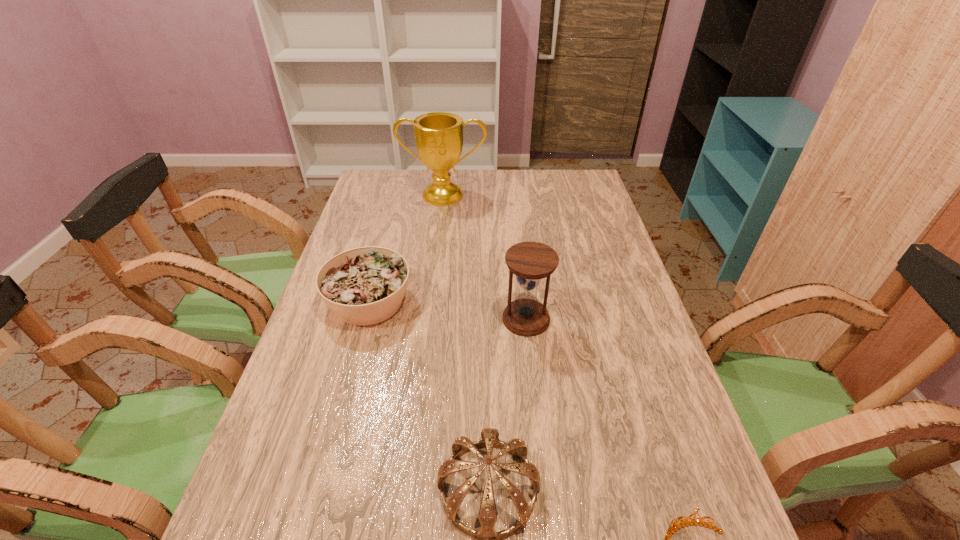
Where is `object located in the far left corner section of the desktop`? The image size is (960, 540). object located in the far left corner section of the desktop is located at coordinates (438, 135).

Where is `free region at the far edge of the desktop`? free region at the far edge of the desktop is located at coordinates (478, 173).

Locate an element on the screen. This screenshot has width=960, height=540. vacant space at the left edge of the desktop is located at coordinates (340, 408).

You are a GUI agent. You are given a task and a screenshot of the screen. Output one action in this format:
    pyautogui.click(x=<x>, y=<y>)
    Task: Click on the vacant area at the right edge of the desktop
    
    Given the screenshot: What is the action you would take?
    pyautogui.click(x=570, y=205)

Identify the location of vacant space at the far right corner. (578, 179).

Identify the location of vacant area that lies between the tallest object and the hourglass. The height and width of the screenshot is (540, 960). (485, 257).

Locate an element on the screen. The image size is (960, 540). free area in between the award and the second tallest object is located at coordinates click(485, 257).

Identify the location of free space that is in between the salad and the second tallest object. This screenshot has height=540, width=960. (447, 310).

Where is `empty space that is in between the farthest object and the hourglass`? empty space that is in between the farthest object and the hourglass is located at coordinates (485, 257).

At what (x,y) coordinates should I click in order to perform the action: click on vacant area between the salad and the award. Please return your answer as a coordinate pair (x, y). The width and height of the screenshot is (960, 540). Looking at the image, I should click on (406, 248).